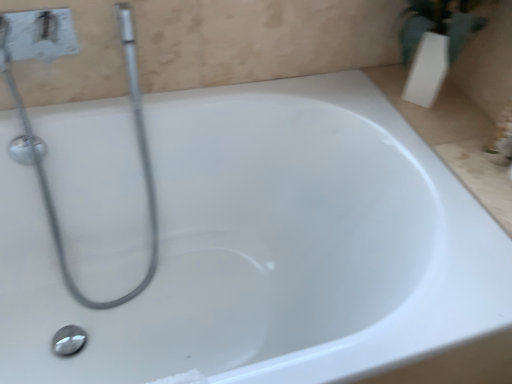
This screenshot has width=512, height=384. Find the location of `polished metallic shower drain at bottom left`. polished metallic shower drain at bottom left is located at coordinates (68, 340).

Describe the element at coordinates (68, 340) in the screenshot. I see `polished metallic shower drain at bottom left` at that location.

Measure the distance between satin chrome showerhead at upper left and camera.

The depth of satin chrome showerhead at upper left is 32.76 inches.

Measure the distance between point (52, 15) and camera.

Point (52, 15) is 84.60 centimeters from camera.

This screenshot has width=512, height=384. Describe the element at coordinates (41, 160) in the screenshot. I see `satin chrome showerhead at upper left` at that location.

Find the location of a particular element. The image size is (512, 384). satin chrome showerhead at upper left is located at coordinates (41, 160).

Where is `polished metallic shower drain at bottom left`? The height and width of the screenshot is (384, 512). polished metallic shower drain at bottom left is located at coordinates (68, 340).

Is satin chrome showerhead at upper left to the left or to the right of polished metallic shower drain at bottom left in the image?

In the image, satin chrome showerhead at upper left appears on the right side of polished metallic shower drain at bottom left.

Is satin chrome showerhead at upper left positioned behind polished metallic shower drain at bottom left?

No, the depth of satin chrome showerhead at upper left is less than that of polished metallic shower drain at bottom left.

Is point (42, 27) farther from camera compared to point (73, 353)?

No, (42, 27) is closer to viewer.

From the image's perspective, is satin chrome showerhead at upper left positioned above or below polished metallic shower drain at bottom left?

satin chrome showerhead at upper left is situated higher than polished metallic shower drain at bottom left in the image.

From a real-world perspective, between satin chrome showerhead at upper left and polished metallic shower drain at bottom left, who is vertically lower?

In real-world perspective, polished metallic shower drain at bottom left is lower.

Can you confirm if satin chrome showerhead at upper left is thinner than polished metallic shower drain at bottom left?

No, satin chrome showerhead at upper left is not thinner than polished metallic shower drain at bottom left.

Based on the photo, considering the relative sizes of satin chrome showerhead at upper left and polished metallic shower drain at bottom left in the image provided, is satin chrome showerhead at upper left taller than polished metallic shower drain at bottom left?

Indeed, satin chrome showerhead at upper left has a greater height compared to polished metallic shower drain at bottom left.

Who is bigger, satin chrome showerhead at upper left or polished metallic shower drain at bottom left?

satin chrome showerhead at upper left is bigger.

Is satin chrome showerhead at upper left not inside polished metallic shower drain at bottom left?

satin chrome showerhead at upper left is positioned outside polished metallic shower drain at bottom left.

Are satin chrome showerhead at upper left and polished metallic shower drain at bottom left far apart?

satin chrome showerhead at upper left is actually quite close to polished metallic shower drain at bottom left.

From the picture: Is satin chrome showerhead at upper left oriented towards polished metallic shower drain at bottom left?

Yes, satin chrome showerhead at upper left is facing polished metallic shower drain at bottom left.

Could you measure the distance between satin chrome showerhead at upper left and polished metallic shower drain at bottom left?

They are 14.81 inches apart.

Identify the location of shower beneath the satin chrome showerhead at upper left (from a real-world perspective). (68, 340).

Which object is positioned more to the left, polished metallic shower drain at bottom left or satin chrome showerhead at upper left?

polished metallic shower drain at bottom left.

Based on the photo, which object is closer to the camera taking this photo, polished metallic shower drain at bottom left or satin chrome showerhead at upper left?

Positioned in front is satin chrome showerhead at upper left.

Which is behind, point (55, 339) or point (48, 205)?

The point (48, 205) is behind.

From the image's perspective, which one is positioned lower, polished metallic shower drain at bottom left or satin chrome showerhead at upper left?

polished metallic shower drain at bottom left is shown below in the image.

From a real-world perspective, is polished metallic shower drain at bottom left physically located above or below satin chrome showerhead at upper left?

From a real-world perspective, polished metallic shower drain at bottom left is physically below satin chrome showerhead at upper left.

Considering the relative sizes of polished metallic shower drain at bottom left and satin chrome showerhead at upper left in the image provided, is polished metallic shower drain at bottom left thinner than satin chrome showerhead at upper left?

Correct, the width of polished metallic shower drain at bottom left is less than that of satin chrome showerhead at upper left.

Which of these two, polished metallic shower drain at bottom left or satin chrome showerhead at upper left, stands shorter?

polished metallic shower drain at bottom left.

In terms of size, does polished metallic shower drain at bottom left appear bigger or smaller than satin chrome showerhead at upper left?

Clearly, polished metallic shower drain at bottom left is smaller in size than satin chrome showerhead at upper left.

Is polished metallic shower drain at bottom left outside of satin chrome showerhead at upper left?

Yes, polished metallic shower drain at bottom left is located beyond the bounds of satin chrome showerhead at upper left.

Looking at this image, is polished metallic shower drain at bottom left next to satin chrome showerhead at upper left and touching it?

polished metallic shower drain at bottom left is not next to satin chrome showerhead at upper left, and they're not touching.

Is polished metallic shower drain at bottom left turned away from satin chrome showerhead at upper left?

Yes, satin chrome showerhead at upper left is at the back of polished metallic shower drain at bottom left.

Measure the distance between polished metallic shower drain at bottom left and satin chrome showerhead at upper left.

polished metallic shower drain at bottom left is 37.61 centimeters away from satin chrome showerhead at upper left.

I want to click on plumbing fixture above the polished metallic shower drain at bottom left (from the image's perspective), so click(x=41, y=160).

The height and width of the screenshot is (384, 512). In the image, there is a satin chrome showerhead at upper left. Find the location of `shower below it (from a real-world perspective)`. shower below it (from a real-world perspective) is located at coordinates (68, 340).

Where is `plumbing fixture in front of the polished metallic shower drain at bottom left`? Image resolution: width=512 pixels, height=384 pixels. plumbing fixture in front of the polished metallic shower drain at bottom left is located at coordinates pyautogui.click(x=41, y=160).